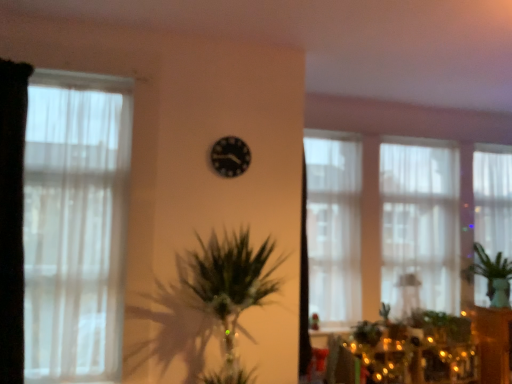
Question: Is wooden cabinet at right inside or outside of translucent fabric window at center, the 3th window in the left-to-right sequence?

Choices:
 (A) outside
 (B) inside

Answer: (A)

Question: Considering the positions of wooden cabinet at right and translucent fabric window at center, the 2th window when ordered from back to front, in the image, is wooden cabinet at right bigger or smaller than translucent fabric window at center, the 2th window when ordered from back to front,?

Choices:
 (A) small
 (B) big

Answer: (B)

Question: Considering the real-world distances, which object is farthest from the translucent fabric window at center, marked as the second window in a left-to-right arrangement?

Choices:
 (A) white sheer curtain at left, the fourth window when ordered from right to left
 (B) black matte clock at center
 (C) green leafy plant at right
 (D) translucent fabric window at right, which is counted as the 1th window, starting from the right
 (E) wooden cabinet at right

Answer: (A)

Question: Estimate the real-world distances between objects in this image. Which object is closer to the translucent fabric window at right, which is counted as the 1th window, starting from the right?

Choices:
 (A) black fabric curtain at left
 (B) green leafy plant at right
 (C) black matte clock at center
 (D) illuminated string lights at lower right
 (E) white sheer curtain at left, which is the first window in front-to-back order

Answer: (B)